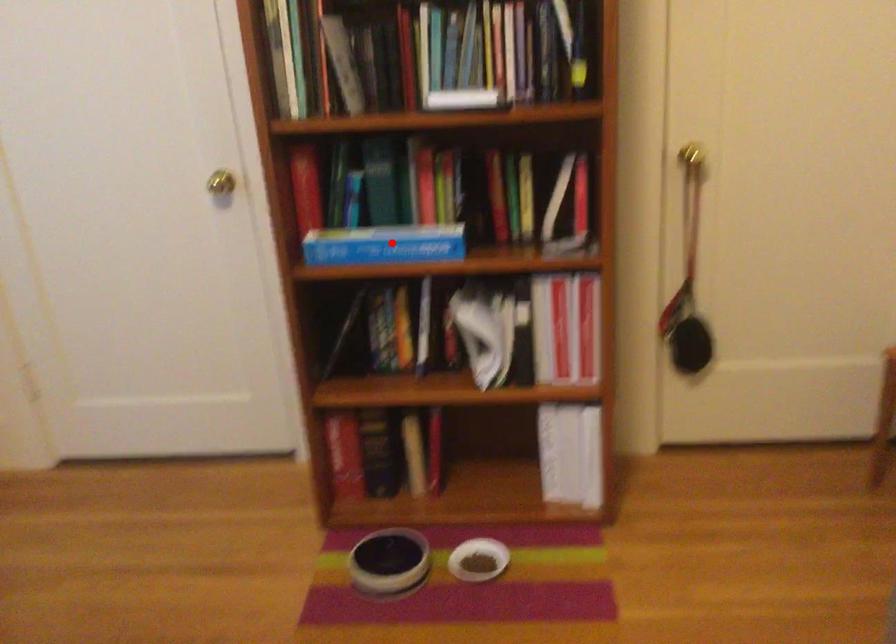
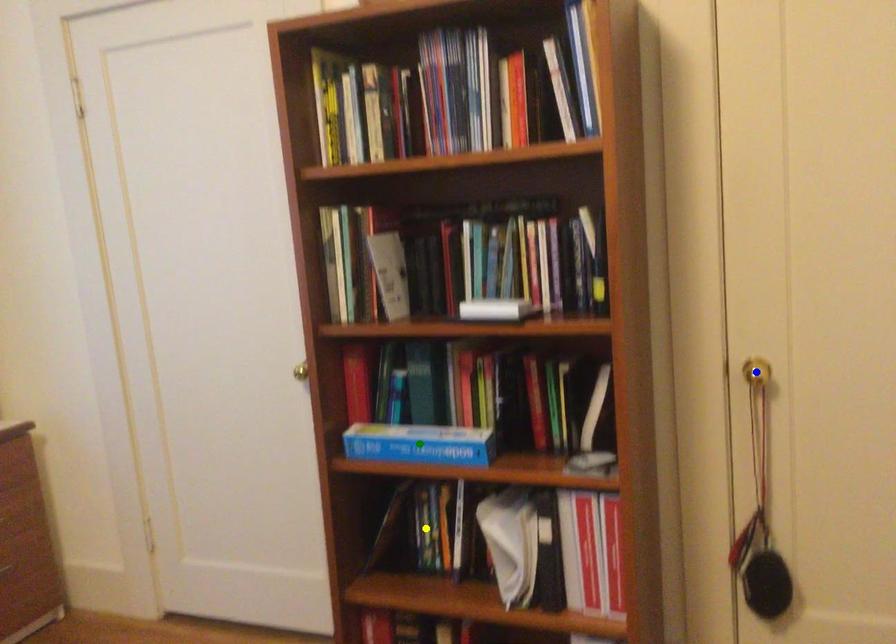
Question: I am providing you with two images of the same scene from different viewpoints. A red point is marked on the first image. You are given multiple points on the second image. Can you choose the point in image 2 that corresponds to the point in image 1?

Choices:
 (A) yellow point
 (B) blue point
 (C) green point

Answer: (C)